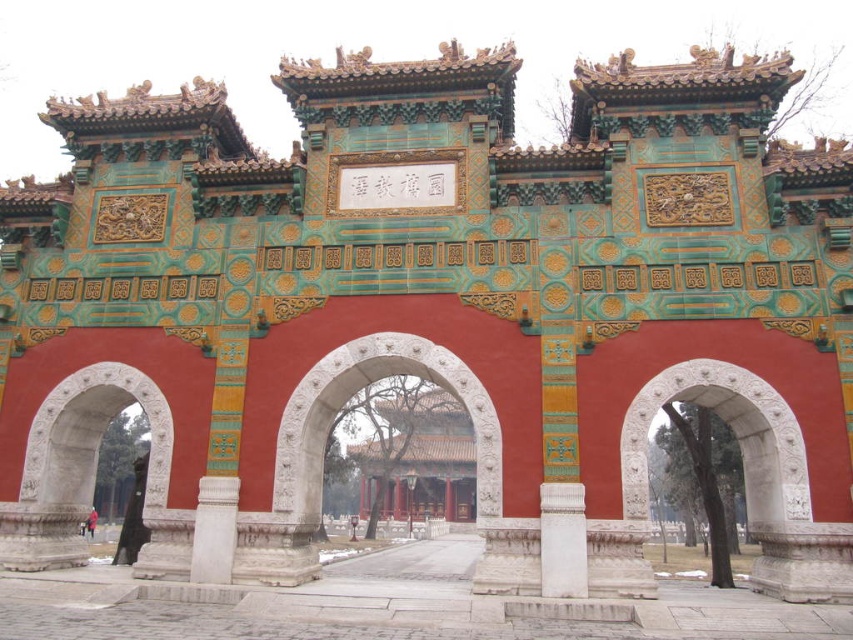
You are standing in front of the traditional Chinese gate and want to enter through the entrance. You notice the white stone archway at right and the white marble pillar at center. Which object is closer to you as you face the gate?

The white stone archway at right is closer to you because it is in front of the white marble pillar at center, meaning it blocks the view of the pillar from your perspective.